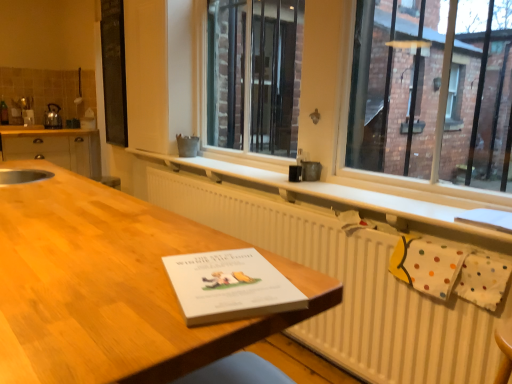
Find the location of a particular element. This screenshot has height=384, width=512. vacant space in front of white paper at center is located at coordinates (145, 340).